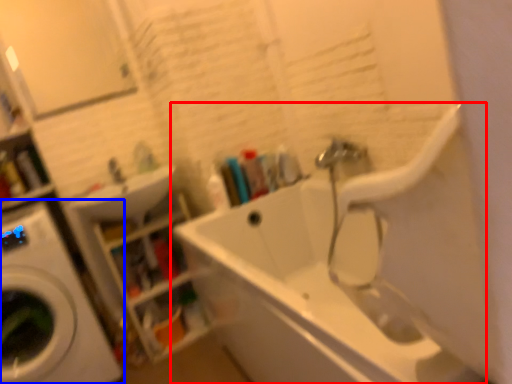
Question: Which of the following is the closest to the observer, bathtub (highlighted by a red box) or washing machine (highlighted by a blue box)?

Choices:
 (A) bathtub
 (B) washing machine

Answer: (A)